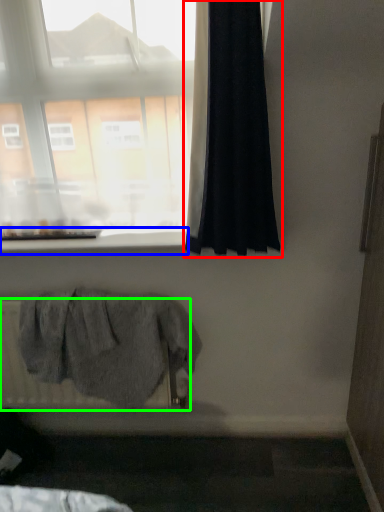
Question: Which is nearer to the curtain (highlighted by a red box)? window sill (highlighted by a blue box) or radiator (highlighted by a green box).

Choices:
 (A) window sill
 (B) radiator

Answer: (A)